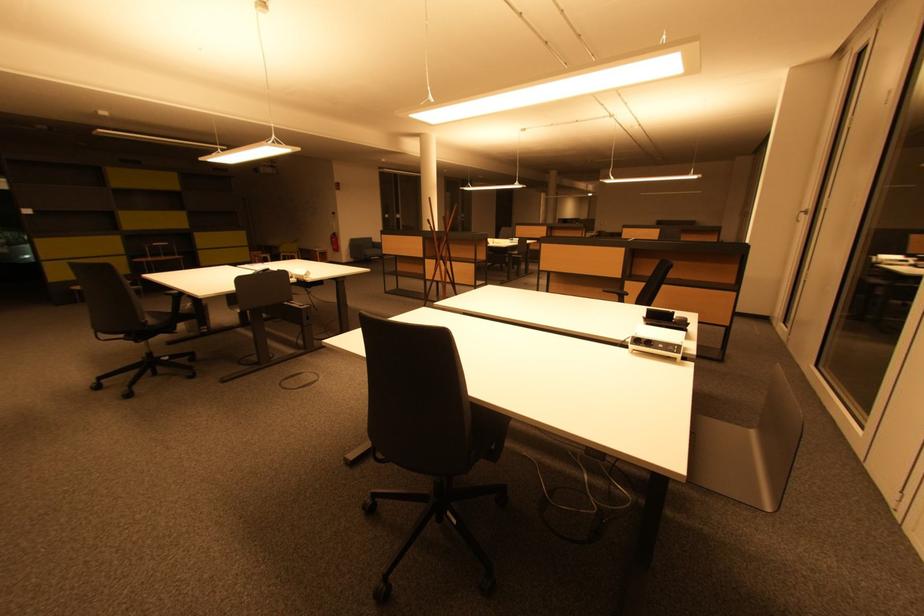
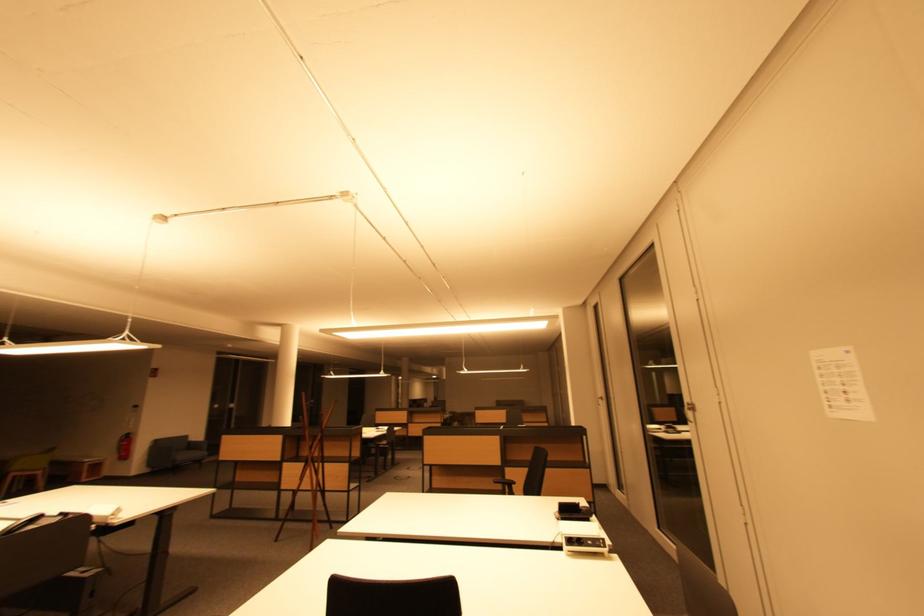
In the second image, find the point that corresponds to (x=374, y=254) in the first image.

(188, 458)